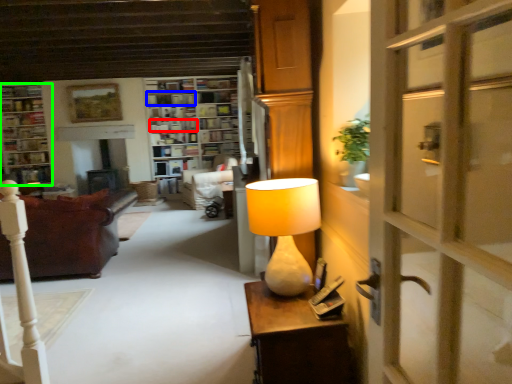
Question: Considering the real-world distances, which object is closest to book (highlighted by a red box)? shelf (highlighted by a blue box) or cabinetry (highlighted by a green box).

Choices:
 (A) shelf
 (B) cabinetry

Answer: (A)